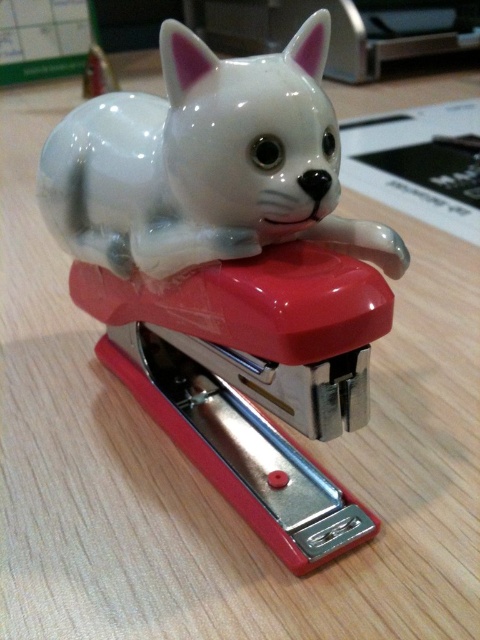
Can you confirm if red glossy stapler at center is wider than white glossy cat at center?

In fact, red glossy stapler at center might be narrower than white glossy cat at center.

Identify the location of red glossy stapler at center. Image resolution: width=480 pixels, height=640 pixels. (253, 378).

Identify the location of red glossy stapler at center. The height and width of the screenshot is (640, 480). (253, 378).